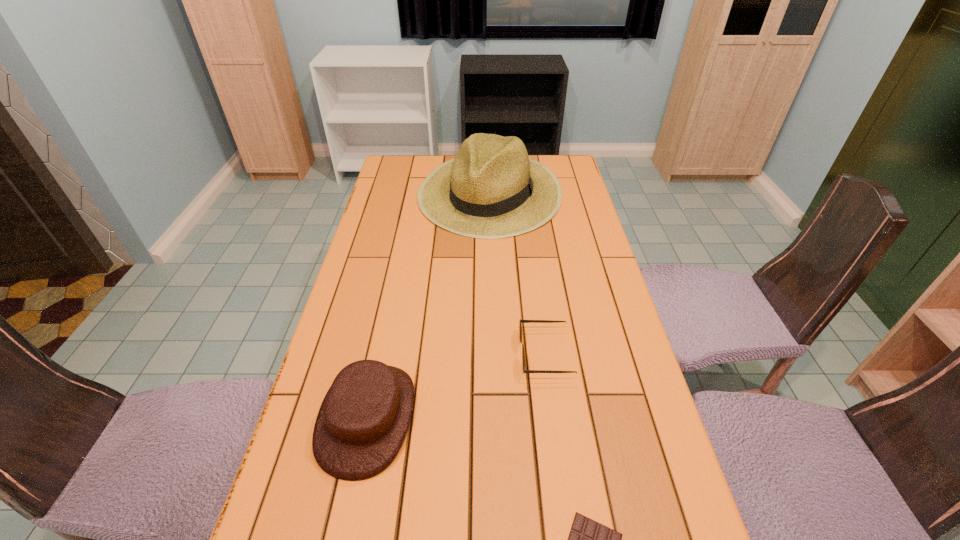
Find the location of a particular element. The height and width of the screenshot is (540, 960). the tallest object is located at coordinates (491, 189).

I want to click on sunhat, so click(x=491, y=189).

Locate an element on the screen. The image size is (960, 540). the third shortest object is located at coordinates (363, 420).

Image resolution: width=960 pixels, height=540 pixels. Find the location of `the second shortest object`. the second shortest object is located at coordinates (521, 321).

Where is `free region located 0.300m on the front of the sunhat`? free region located 0.300m on the front of the sunhat is located at coordinates (493, 305).

The height and width of the screenshot is (540, 960). What are the coordinates of `vacant region located on the right of the third shortest object` in the screenshot? It's located at (538, 417).

Identify the location of vacant region located on the front-facing side of the second shortest object. (492, 354).

Where is `vacant space located 0.060m on the front-facing side of the second shortest object`? The image size is (960, 540). vacant space located 0.060m on the front-facing side of the second shortest object is located at coordinates (496, 354).

Locate an element on the screen. This screenshot has height=540, width=960. vacant space located on the front-facing side of the second shortest object is located at coordinates (391, 354).

The height and width of the screenshot is (540, 960). Find the location of `object that is at the far edge`. object that is at the far edge is located at coordinates (491, 189).